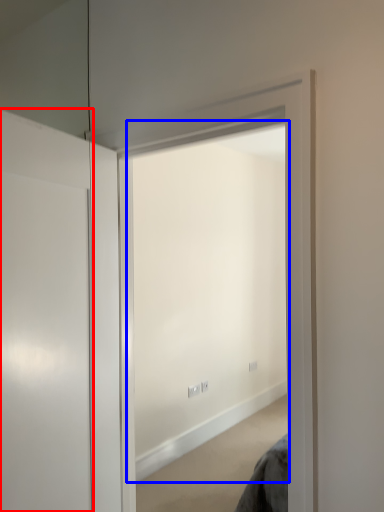
Question: Which object appears farthest to the camera in this image, door (highlighted by a red box) or window (highlighted by a blue box)?

Choices:
 (A) door
 (B) window

Answer: (B)